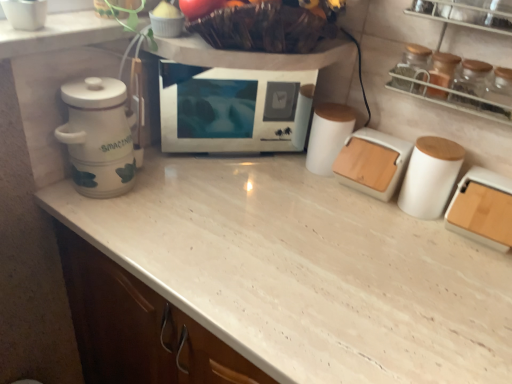
Image resolution: width=512 pixels, height=384 pixels. In order to click on vacant area that lies in front of white matte bread bin at center-right, acting as the 1th kitchen appliance starting from the left in this screenshot , I will do `click(375, 236)`.